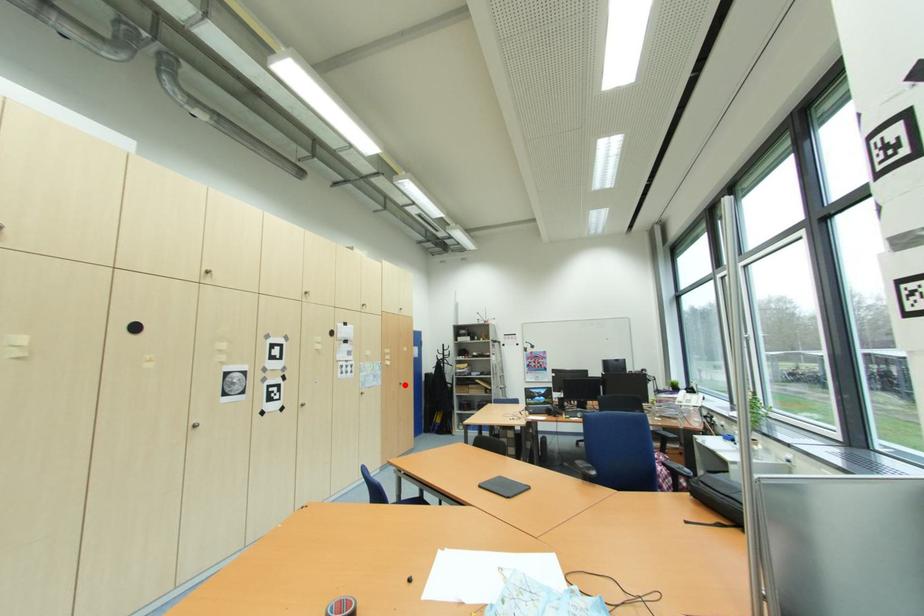
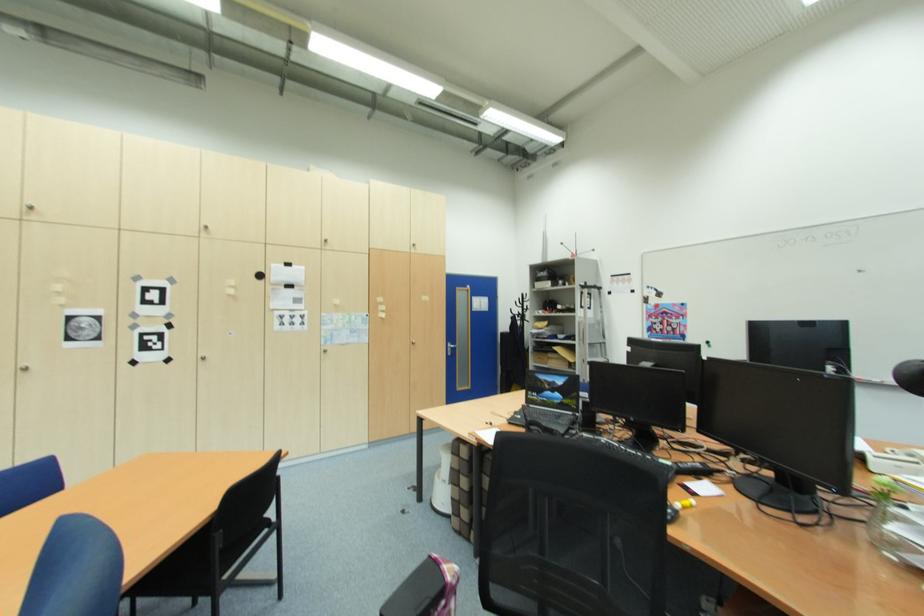
Question: I am providing you with two images of the same scene from different viewpoints. Image1 has a red point marked. In image2, the corresponding 3D location appears at what relative position? Reply with the corresponding letter.

Choices:
 (A) Closer
 (B) Farther

Answer: (A)